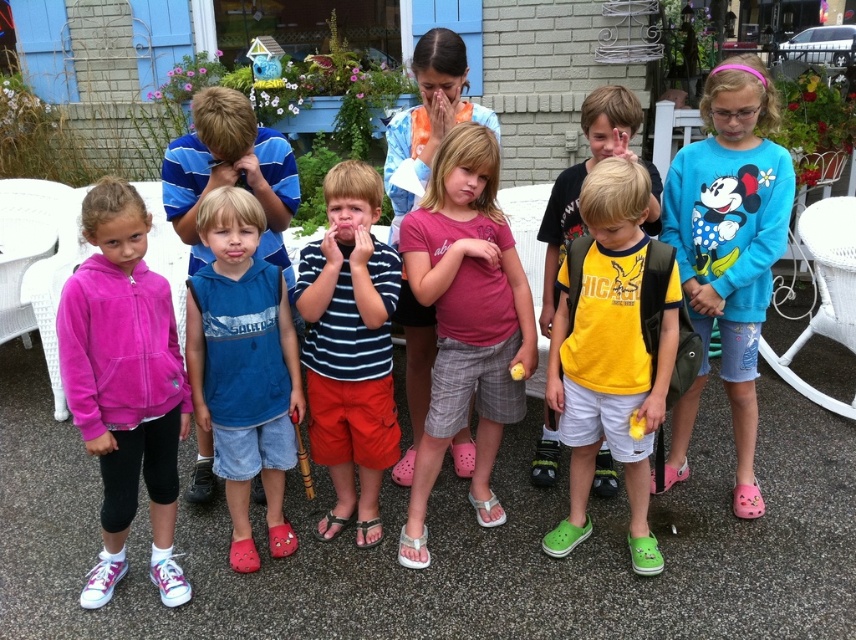
Does pink fleece hoodie at left appear under blue cotton hoodie at center?

Indeed, pink fleece hoodie at left is positioned under blue cotton hoodie at center.

Where is `pink fleece hoodie at left`? pink fleece hoodie at left is located at coordinates (123, 385).

Looking at this image, which of these two, pink cotton shirt at center or yellow matte t-shirt at center, stands shorter?

yellow matte t-shirt at center

Who is more forward, (403, 244) or (569, 432)?

Point (403, 244) is more forward.

Where is `pink cotton shirt at center`? This screenshot has width=856, height=640. pink cotton shirt at center is located at coordinates (467, 321).

Who is more distant from viewer, (562, 371) or (248, 420)?

Positioned behind is point (562, 371).

Can you confirm if yellow matte t-shirt at center is taller than blue cotton hoodie at center?

Correct, yellow matte t-shirt at center is much taller as blue cotton hoodie at center.

Is point (615, 188) farther from viewer compared to point (301, 413)?

No, (615, 188) is closer to viewer.

Where is `yellow matte t-shirt at center`? yellow matte t-shirt at center is located at coordinates (610, 355).